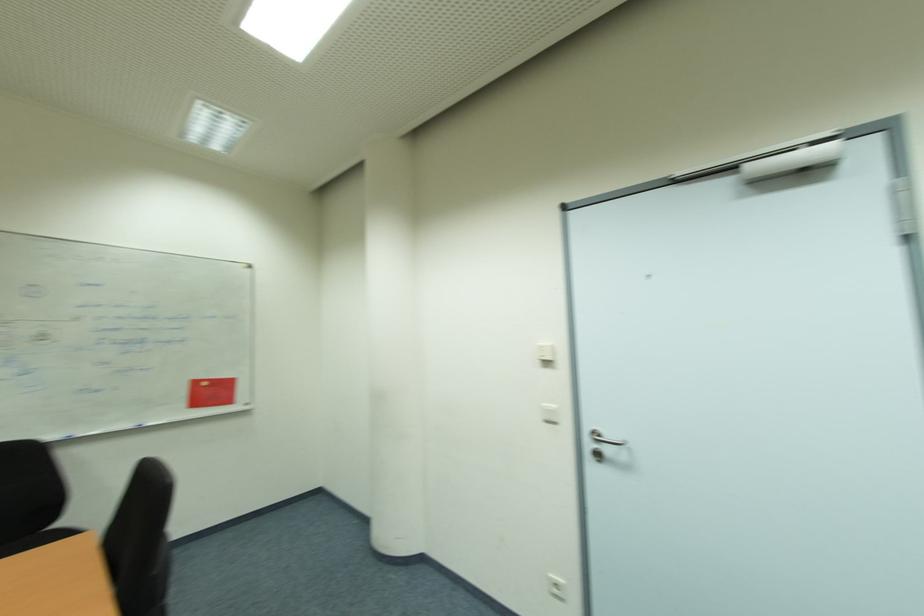
You are a GUI agent. You are given a task and a screenshot of the screen. Output one action in this format:
    pyautogui.click(x=<x>, y=<y>)
    Task: Click on the metal door handle
    The width and height of the screenshot is (924, 616).
    Given the screenshot: What is the action you would take?
    pyautogui.click(x=604, y=439)